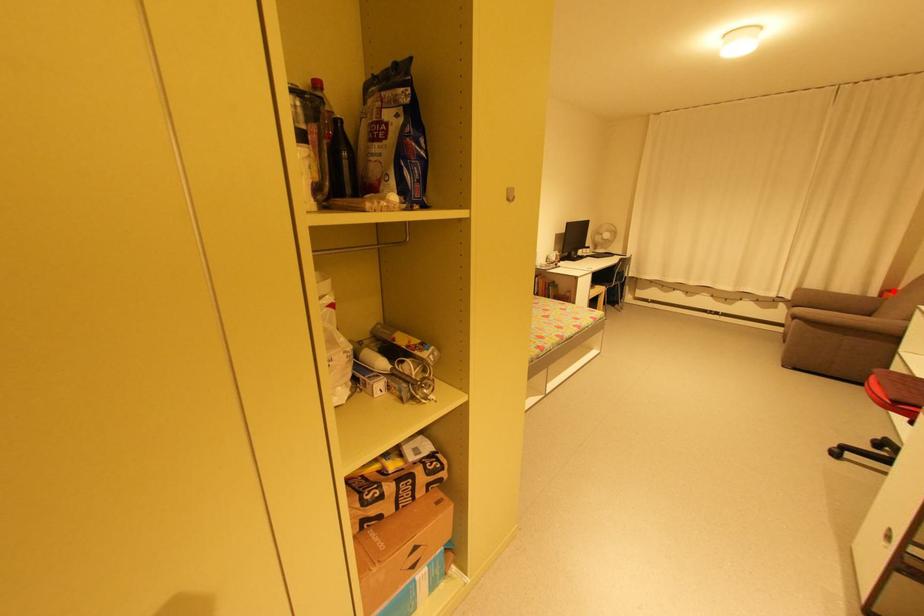
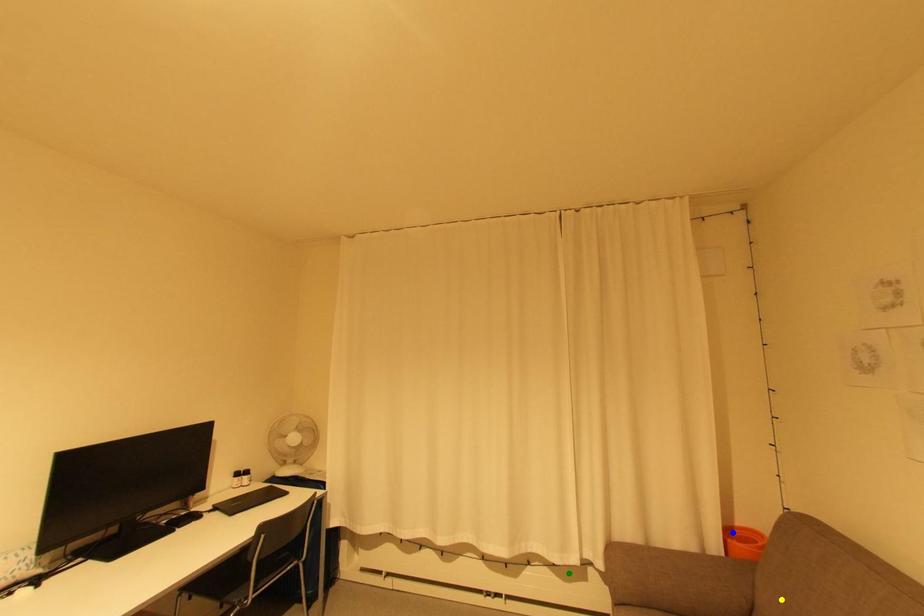
Question: I am providing you with two images of the same scene from different viewpoints. A red point is marked on the first image. You are given multiple points on the second image. Which point in image 2 is actually the same real-world point as the red point in image 1?

Choices:
 (A) green point
 (B) yellow point
 (C) blue point

Answer: (C)